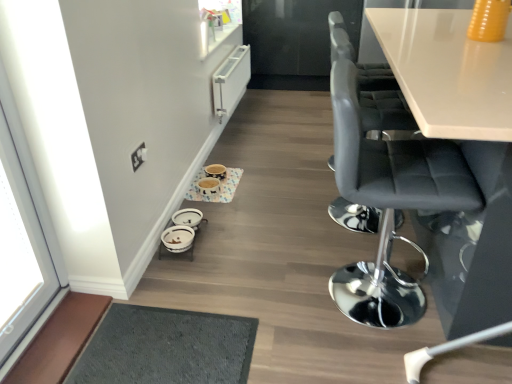
This screenshot has height=384, width=512. Identify the location of vacant area that lies in front of black leather stool at right, placed as the first chair when sorted from front to back. (375, 354).